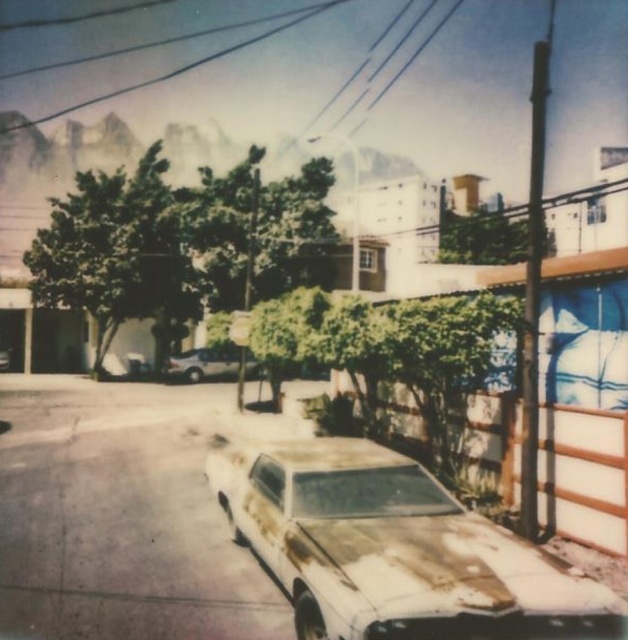
From the picture: Who is shorter, rusty metal car at lower center or rusty metallic car at center?

rusty metal car at lower center is shorter.

Based on the photo, is rusty metal car at lower center above rusty metallic car at center?

No, rusty metal car at lower center is not above rusty metallic car at center.

Locate an element on the screen. This screenshot has height=640, width=628. rusty metal car at lower center is located at coordinates (394, 548).